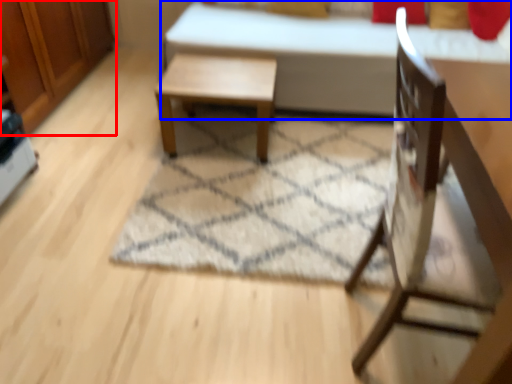
Question: Which point is further to the camera, dresser (highlighted by a red box) or bed (highlighted by a blue box)?

Choices:
 (A) dresser
 (B) bed

Answer: (B)